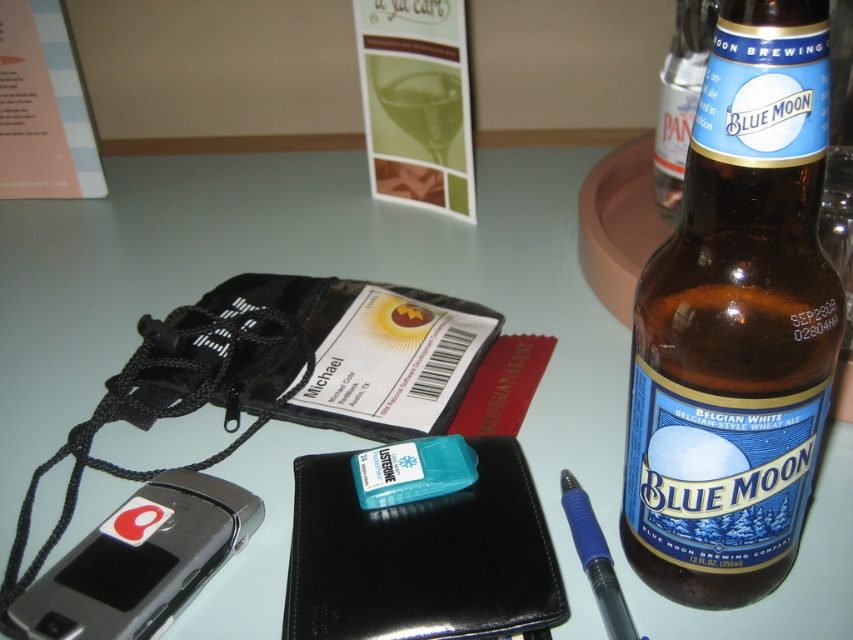
What are the coordinates of `silver metallic smartphone at lower left` in the screenshot? It's located at point(138,561).

Which is below, silver metallic smartphone at lower left or green glass at upper center?

silver metallic smartphone at lower left

Which is behind, point (149, 605) or point (419, 134)?

Positioned behind is point (419, 134).

You are a GUI agent. You are given a task and a screenshot of the screen. Output one action in this format:
    pyautogui.click(x=<x>, y=<y>)
    Task: Click on the silver metallic smartphone at lower left
    The width and height of the screenshot is (853, 640).
    Given the screenshot: What is the action you would take?
    pyautogui.click(x=138, y=561)

Who is shorter, brown glass bottle at upper right or blue rubberized pen at right?

With less height is blue rubberized pen at right.

Does brown glass bottle at upper right have a larger size compared to blue rubberized pen at right?

Yes.

Locate an element on the screen. brown glass bottle at upper right is located at coordinates (680, 99).

Is brown glass bottle at right wider than silver metallic smartphone at lower left?

No.

Is point (809, 35) farther from viewer compared to point (79, 620)?

No.

I want to click on brown glass bottle at right, so click(735, 323).